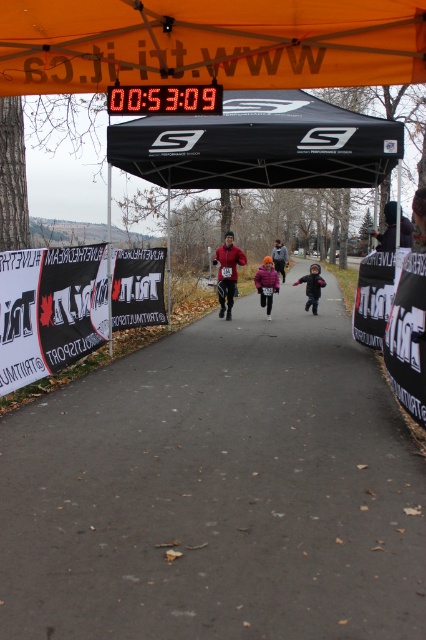
You are a runner in the race and want to check the time on the digital clock under the orange canopy tent. Which direction should you look relative to the dark gray hoodie at center and the gray asphalt path at center?

You should look to the right of the dark gray hoodie at center because the gray asphalt path at center is to the left of it, so the clock is likely positioned further right beyond the hoodie.

You are a runner participating in a race and need to stay on the gray asphalt path at center. Based on the coordinates provided, can you confirm if the path is located in the central area of the image?

The gray asphalt path at center is located at coordinates point (218, 490), which is near the center of the image, so yes, it is in the central area.

You are a photographer standing at the starting line of the race. You want to take a photo that includes both the point at coordinates point (71, 436) and point (287, 257). Which point will appear larger in the photo?

Point (71, 436) is closer to the camera than point (287, 257), so it will appear larger in the photo.